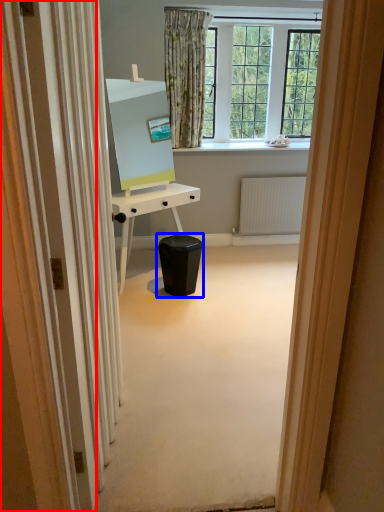
Question: Which point is further to the camera, screen door (highlighted by a red box) or music stool (highlighted by a blue box)?

Choices:
 (A) screen door
 (B) music stool

Answer: (B)